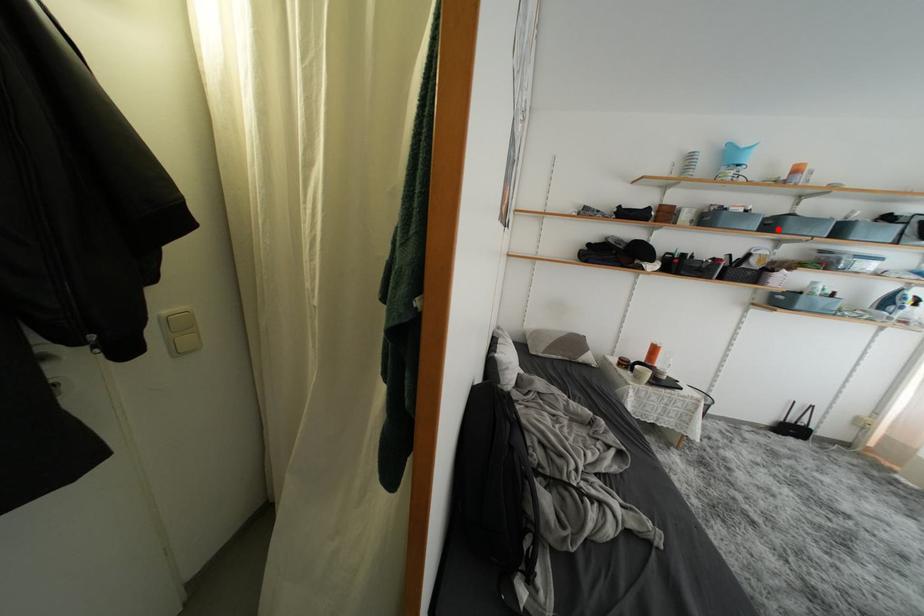
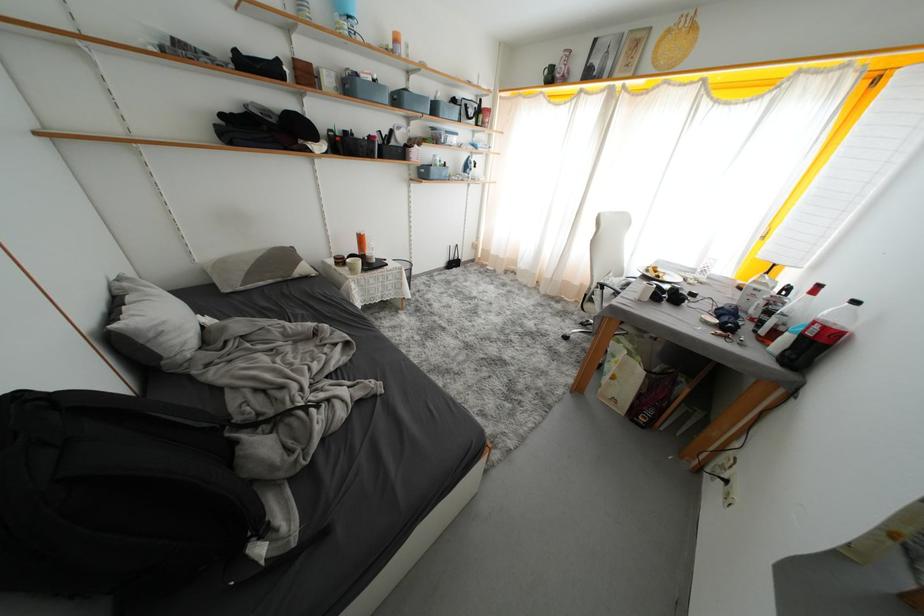
In the second image, find the point that corresponds to the highlighted location in the first image.

(404, 103)